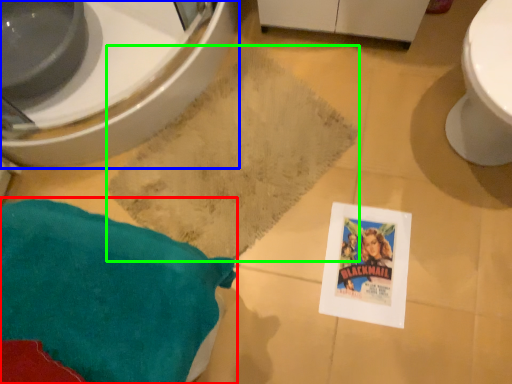
Question: Considering the real-world distances, which object is farthest from throw pillow (highlighted by a red box)? bidet (highlighted by a blue box) or bath mat (highlighted by a green box)?

Choices:
 (A) bidet
 (B) bath mat

Answer: (A)